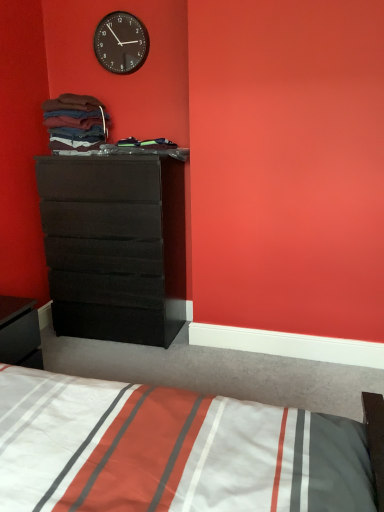
Question: Could black plastic wall clock at upper center be considered to be inside black glossy nightstand at lower left?

Choices:
 (A) yes
 (B) no

Answer: (B)

Question: Is black glossy nightstand at lower left not near black plastic wall clock at upper center?

Choices:
 (A) no
 (B) yes

Answer: (B)

Question: From a real-world perspective, is black glossy nightstand at lower left located beneath black plastic wall clock at upper center?

Choices:
 (A) yes
 (B) no

Answer: (A)

Question: Does black glossy nightstand at lower left have a smaller size compared to black plastic wall clock at upper center?

Choices:
 (A) yes
 (B) no

Answer: (B)

Question: Is black glossy nightstand at lower left positioned with its back to black plastic wall clock at upper center?

Choices:
 (A) no
 (B) yes

Answer: (A)

Question: Does black glossy nightstand at lower left have a greater width compared to black plastic wall clock at upper center?

Choices:
 (A) no
 (B) yes

Answer: (B)

Question: From the image's perspective, does multicolored fabric at upper left appear higher than black glossy nightstand at lower left?

Choices:
 (A) yes
 (B) no

Answer: (A)

Question: Could you tell me if multicolored fabric at upper left is facing black glossy nightstand at lower left?

Choices:
 (A) no
 (B) yes

Answer: (A)

Question: Is multicolored fabric at upper left at the right side of black glossy nightstand at lower left?

Choices:
 (A) no
 (B) yes

Answer: (B)

Question: From the image's perspective, is multicolored fabric at upper left under black glossy nightstand at lower left?

Choices:
 (A) no
 (B) yes

Answer: (A)

Question: Does multicolored fabric at upper left have a larger size compared to black glossy nightstand at lower left?

Choices:
 (A) no
 (B) yes

Answer: (B)

Question: Is multicolored fabric at upper left wider than black glossy nightstand at lower left?

Choices:
 (A) yes
 (B) no

Answer: (A)

Question: Does white striped fabric at lower center touch black glossy nightstand at lower left?

Choices:
 (A) yes
 (B) no

Answer: (B)